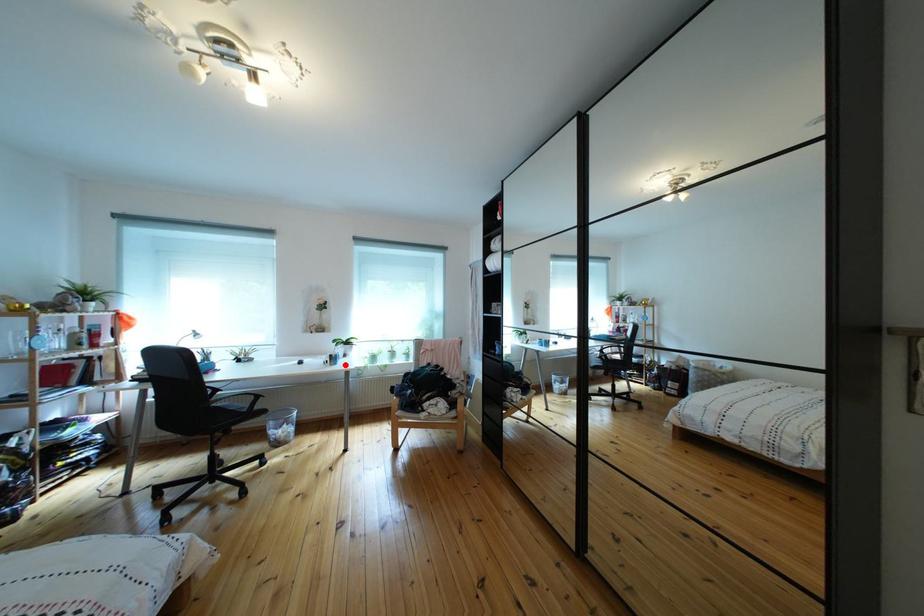
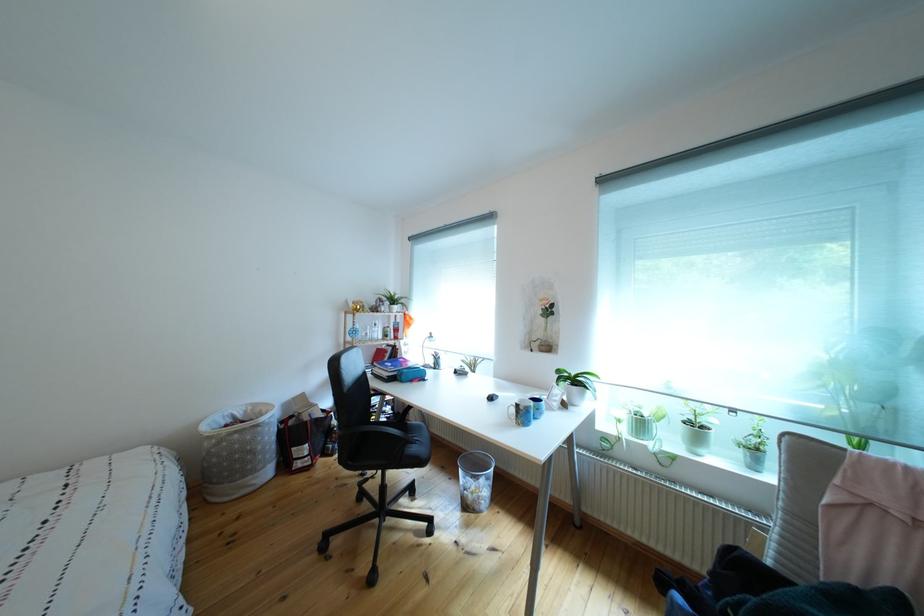
Where in the second image is the point corresponding to the highlighted location from the first image?

(533, 419)